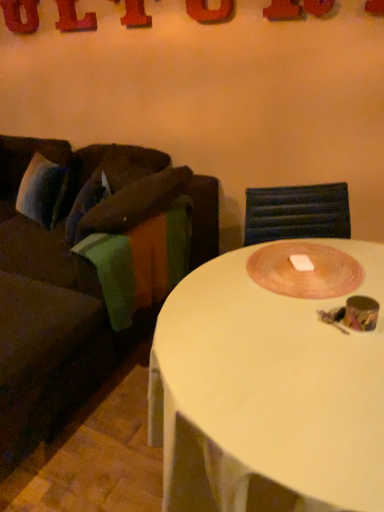
Question: Does white plastic coffee table at center have a larger size compared to red plastic letter l at upper left, which ranks as the fourth letter in front-to-back order?

Choices:
 (A) yes
 (B) no

Answer: (A)

Question: Is white plastic coffee table at center looking in the opposite direction of red plastic letter l at upper left, which ranks as the fourth letter in front-to-back order?

Choices:
 (A) yes
 (B) no

Answer: (B)

Question: Does white plastic coffee table at center have a greater width compared to red plastic letter l at upper left, which ranks as the fourth letter in front-to-back order?

Choices:
 (A) yes
 (B) no

Answer: (A)

Question: Is white plastic coffee table at center far away from red plastic letter l at upper left, acting as the 2th letter starting from the left?

Choices:
 (A) no
 (B) yes

Answer: (B)

Question: Considering the relative sizes of white plastic coffee table at center and red plastic letter l at upper left, the second letter from the back, in the image provided, is white plastic coffee table at center thinner than red plastic letter l at upper left, the second letter from the back,?

Choices:
 (A) yes
 (B) no

Answer: (B)

Question: From the image's perspective, relative to red plastic letter at upper left, which is the 5th letter in front-to-back order, is green fabric blanket at left above or below?

Choices:
 (A) above
 (B) below

Answer: (B)

Question: Is green fabric blanket at left to the left or to the right of red plastic letter at upper left, which is the 5th letter in front-to-back order, in the image?

Choices:
 (A) right
 (B) left

Answer: (A)

Question: From a real-world perspective, is green fabric blanket at left above or below red plastic letter at upper left, which appears as the 5th letter when viewed from the right?

Choices:
 (A) above
 (B) below

Answer: (B)

Question: From their relative heights in the image, would you say green fabric blanket at left is taller or shorter than red plastic letter at upper left, which is the 5th letter in front-to-back order?

Choices:
 (A) short
 (B) tall

Answer: (B)

Question: Choose the correct answer: Is metallic red letter at upper center, which is counted as the third letter, starting from the left, inside wooden placemat at center or outside it?

Choices:
 (A) inside
 (B) outside

Answer: (B)

Question: From the image's perspective, is metallic red letter at upper center, arranged as the third letter when viewed from the front, located above or below wooden placemat at center?

Choices:
 (A) above
 (B) below

Answer: (A)

Question: Considering their positions, is metallic red letter at upper center, arranged as the third letter when viewed from the front, located in front of or behind wooden placemat at center?

Choices:
 (A) front
 (B) behind

Answer: (B)

Question: From a real-world perspective, relative to wooden placemat at center, is metallic red letter at upper center, arranged as the third letter when viewed from the front, vertically above or below?

Choices:
 (A) below
 (B) above

Answer: (B)

Question: From the image's perspective, is wooden placemat at center above or below red plastic letter at upper right, which appears as the first letter when viewed from the front?

Choices:
 (A) above
 (B) below

Answer: (B)

Question: From a real-world perspective, is wooden placemat at center physically located above or below red plastic letter at upper right, which appears as the first letter when viewed from the front?

Choices:
 (A) below
 (B) above

Answer: (A)